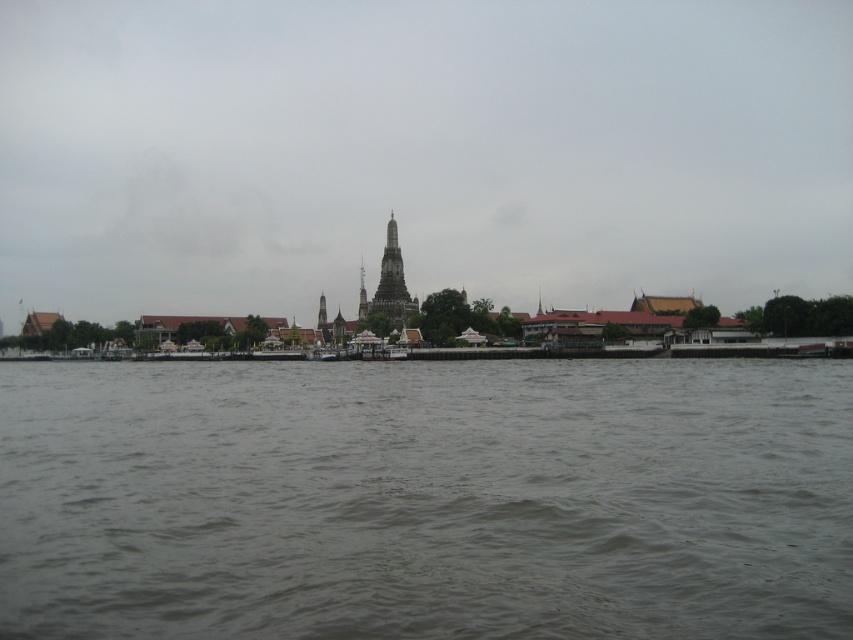
Identify the location of transparent sky at center. This screenshot has width=853, height=640. (421, 152).

Is point (355, 108) less distant than point (360, 273)?

Yes, point (355, 108) is in front of point (360, 273).

Does point (616, 88) lie behind point (358, 289)?

That is False.

Where is `transparent sky at center`? transparent sky at center is located at coordinates (421, 152).

Between point (135, 404) and point (358, 321), which one is positioned behind?

The point (358, 321) is more distant.

Find the location of a particular element. The height and width of the screenshot is (640, 853). brown murky water at center is located at coordinates pos(426,499).

Is transparent sky at center closer to the viewer compared to brown murky water at center?

That is False.

From the picture: Measure the distance from transparent sky at center to brown murky water at center.

A distance of 125.59 meters exists between transparent sky at center and brown murky water at center.

Locate an element on the screen. The width and height of the screenshot is (853, 640). transparent sky at center is located at coordinates tap(421, 152).

Locate an element on the screen. Image resolution: width=853 pixels, height=640 pixels. transparent sky at center is located at coordinates (421, 152).